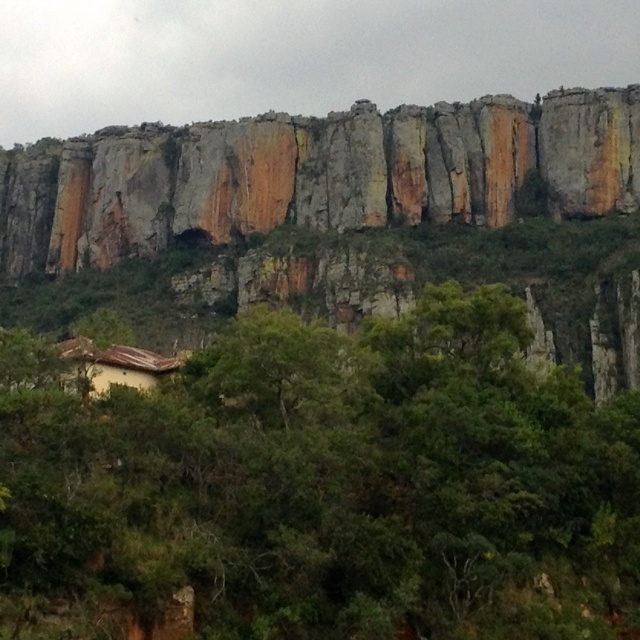
You are standing at the base of the cliff and want to take a photo of the green leafy tree at center. If your camera has a maximum focus range of 35 meters, will you be able to capture the tree clearly?

The green leafy tree at center is 36.64 meters away from the camera. Since the camera can only focus up to 35 meters, it won

You are a hiker who wants to take a photo of the rustic stone cliff at upper center. You have a camera with a standard lens that can capture objects up to 10 meters tall. Can the green leafy tree at center block your view of the cliff?

The green leafy tree at center is smaller than the rustic stone cliff at upper center, so the tree will not block the view of the cliff as long as you position yourself where the tree isn

Looking at this image, you are standing at the base of the cliff and want to reach the point marked at coordinates point (323,468). Given that the cliff is steep and the terrain is rocky, do you think you can safely walk to that point without any equipment?

The point marked at coordinates point (323,468) is 46.62 meters away from the viewer. Considering the steep and rocky terrain of the cliff, it would be unsafe to walk there without proper equipment.